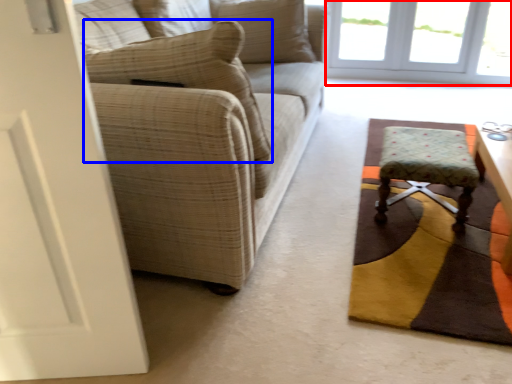
Question: Which object is further to the camera taking this photo, window (highlighted by a red box) or pillow (highlighted by a blue box)?

Choices:
 (A) window
 (B) pillow

Answer: (A)